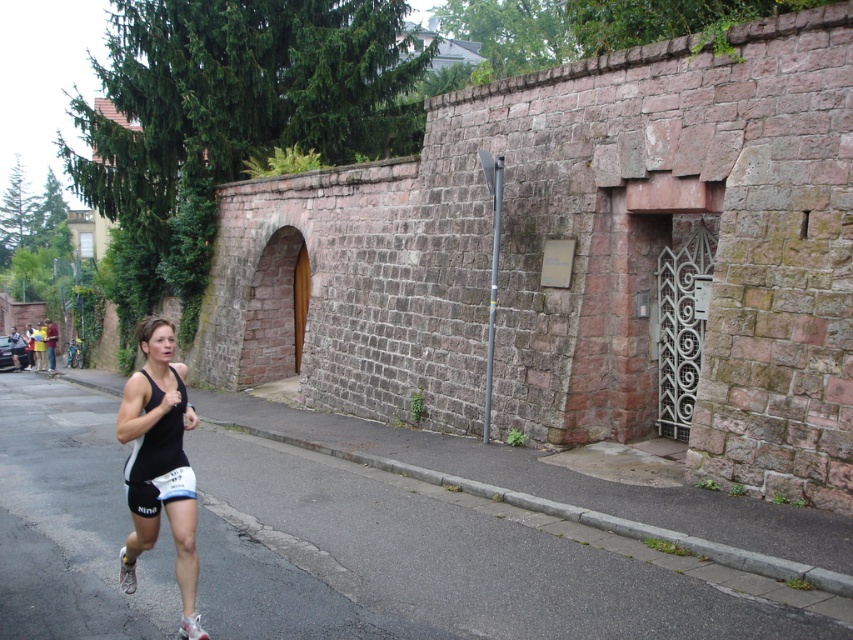
Based on the photo, is black fabric runner at lower left above black matte tank top at lower left?

Incorrect, black fabric runner at lower left is not positioned above black matte tank top at lower left.

Who is more distant from viewer, (560, 564) or (177, 412)?

The point (560, 564) is more distant.

Find the location of a particular element. The image size is (853, 640). black fabric runner at lower left is located at coordinates (448, 563).